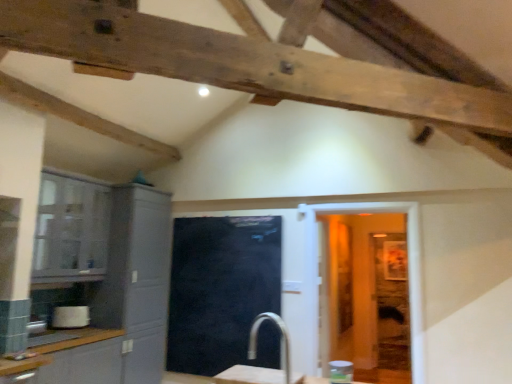
I want to click on vacant region above black glass door at center (from a real-world perspective), so click(x=227, y=216).